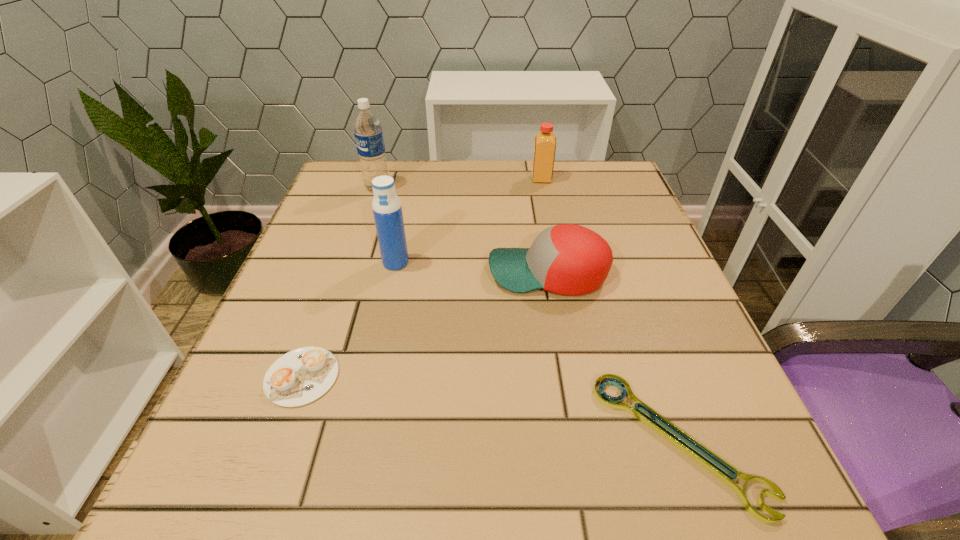
Where is `free space between the baseball cap and the shortest object`? free space between the baseball cap and the shortest object is located at coordinates pyautogui.click(x=613, y=357).

At what (x,y) coordinates should I click in order to perform the action: click on empty space between the orange juice and the wrench. Please return your answer as a coordinate pair (x, y). Looking at the image, I should click on (611, 310).

Select which object is the second closest to the cappuccino. Please provide its 2D coordinates. Your answer should be formatted as a tuple, i.e. [(x, y)], where the tuple contains the x and y coordinates of a point satisfying the conditions above.

[(568, 259)]

Locate an element on the screen. object that is the nearest to the baseball cap is located at coordinates (387, 210).

At what (x,y) coordinates should I click in order to perform the action: click on vacant point that satisfies the following two spatial constraints: 1. on the front and back of the third tallest object; 2. on the left side of the wrench. Please return your answer as a coordinate pair (x, y). Looking at the image, I should click on (595, 442).

I want to click on free location that satisfies the following two spatial constraints: 1. at the brim of the baseball cap; 2. on the left side of the shortest object, so click(577, 442).

You are a GUI agent. You are given a task and a screenshot of the screen. Output one action in this format:
    pyautogui.click(x=<x>, y=<y>)
    Task: Click on the vacant area in the image that satisfies the following two spatial constraints: 1. at the brim of the baseball cap; 2. on the left side of the wrench
    
    Given the screenshot: What is the action you would take?
    pyautogui.click(x=577, y=442)